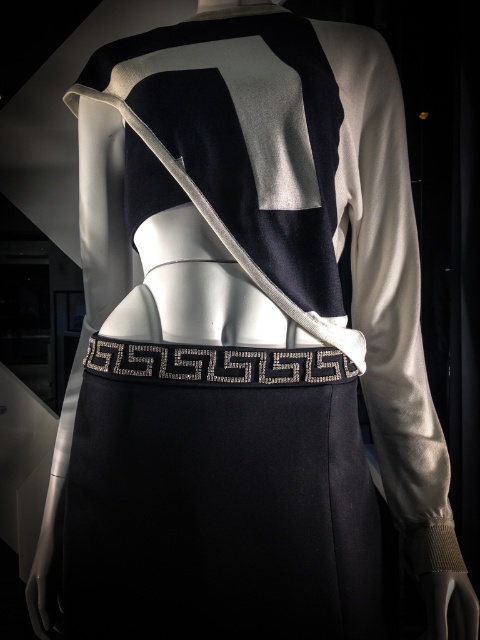
Where is the black satin apron at center located in the image?

The black satin apron at center is located at point [218,497].

You are a fashion designer trying to adjust the placement of the black satin apron at center and the silver metallic belt at center on a mannequin. The apron needs to be positioned exactly 5 inches away from the belt. Based on the current setup, is the apron positioned correctly?

The black satin apron at center is currently 4.97 inches away from the silver metallic belt at center, which is very close to the desired 5 inches. The apron is positioned correctly as the slight difference is negligible and within typical design tolerances.